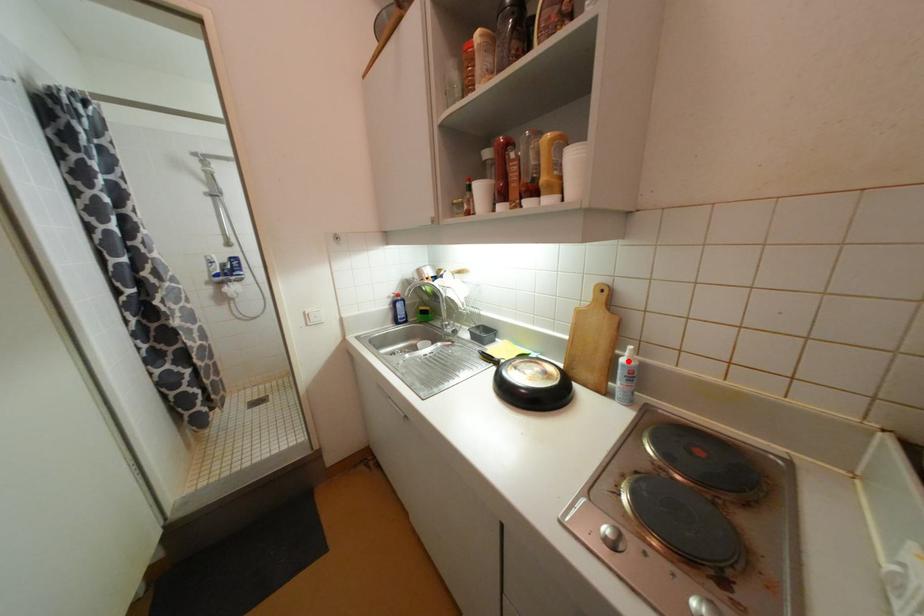
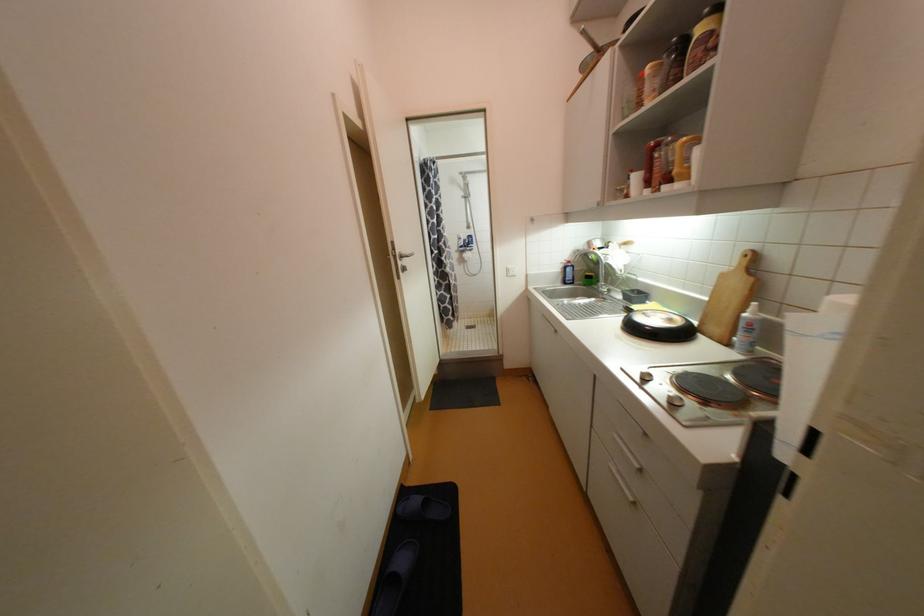
Where in the second image is the point corresponding to the highlighted location from the first image?

(750, 315)